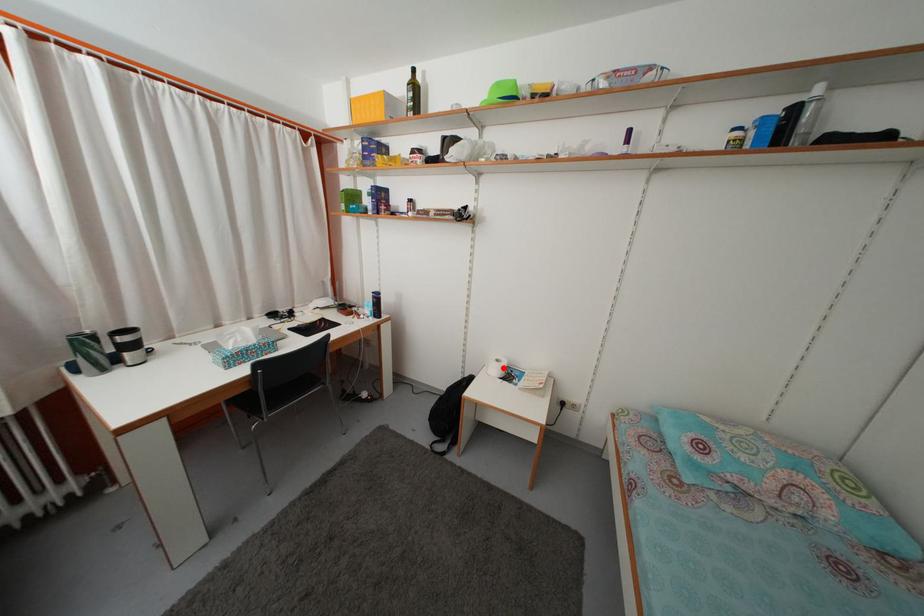
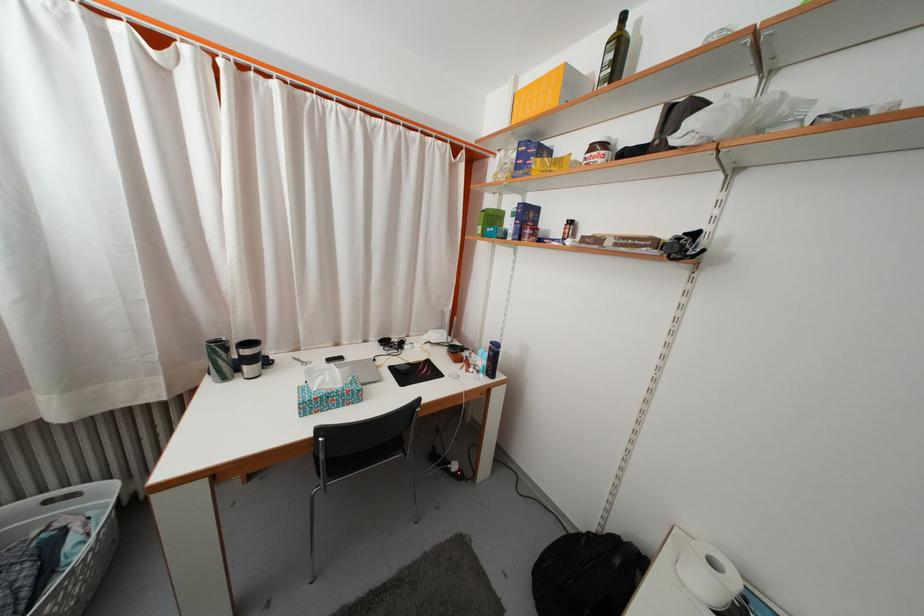
In the second image, find the point that corresponds to the highlighted location in the first image.

(718, 570)